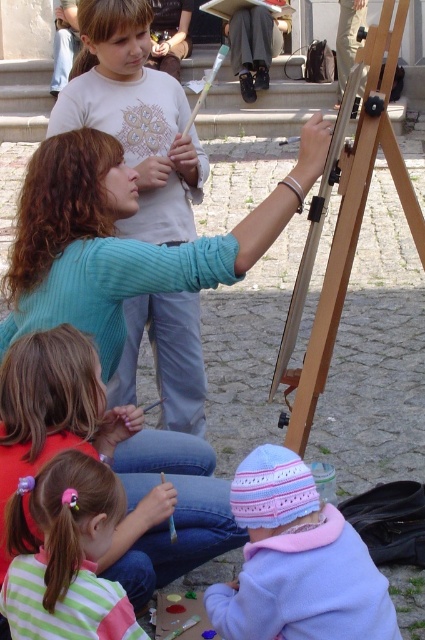
Question: Which object is closer to the camera taking this photo?

Choices:
 (A) pink hairband at lower left
 (B) light blue sweater at upper center

Answer: (A)

Question: Which of the following is the closest to the observer?

Choices:
 (A) pastel knit hat at lower center
 (B) teal ribbed sweater at upper left

Answer: (A)

Question: Is pink hairband at lower left closer to the viewer compared to wooden easel at center?

Choices:
 (A) yes
 (B) no

Answer: (A)

Question: Is teal ribbed sweater at upper left to the left of wooden easel at center from the viewer's perspective?

Choices:
 (A) no
 (B) yes

Answer: (B)

Question: Does light blue sweater at upper center appear over wooden easel at center?

Choices:
 (A) yes
 (B) no

Answer: (A)

Question: Which point is closer to the camera?

Choices:
 (A) pink hairband at lower left
 (B) pastel knit hat at lower center
 (C) light blue sweater at upper center
 (D) teal ribbed sweater at upper left

Answer: (A)